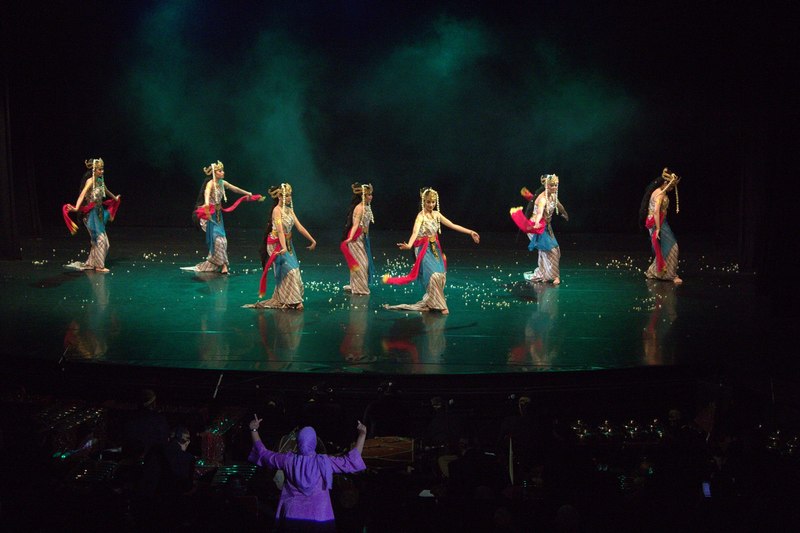
At what (x,y) coordinates should I click in order to perform the action: click on sashes. Please return your answer as a coordinate pair (x, y). This screenshot has height=533, width=800. Looking at the image, I should click on (64, 217), (198, 209), (257, 268), (340, 251), (394, 274), (512, 207), (654, 247).